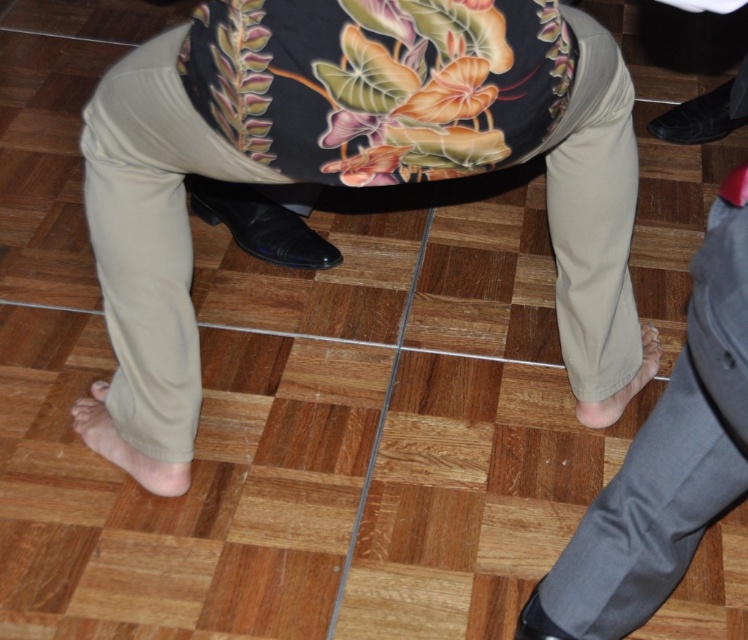
Based on the coordinates provided, can you identify which object corresponds to the point located at (260, 225)?

The point at (260, 225) corresponds to the black leather shoe at lower left.

Based on the scene description, which object is wider between the black leather shoe at lower left and the tan fabric foot at lower right?

The black leather shoe at lower left is wider than the tan fabric foot at lower right according to the description.